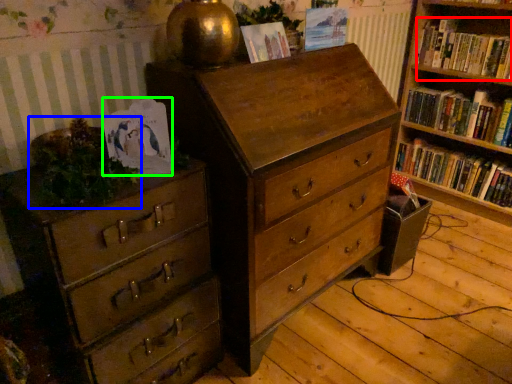
Question: Which object is positioned farthest from book (highlighted by a red box)? Select from plant (highlighted by a blue box) and paperback book (highlighted by a green box).

Choices:
 (A) plant
 (B) paperback book

Answer: (A)